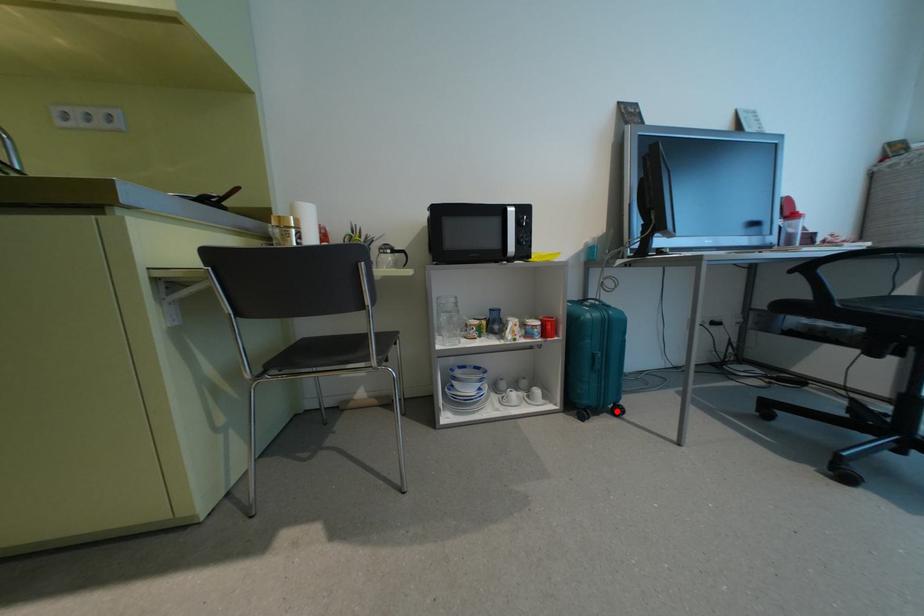
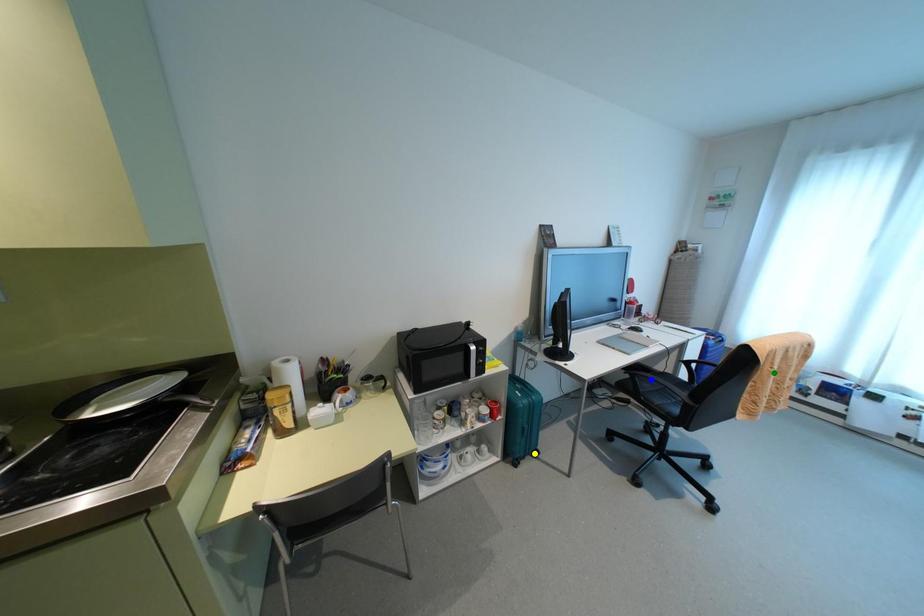
Question: I am providing you with two images of the same scene from different viewpoints. A red point is marked on the first image. You are given multiple points on the second image. Can you choose the point in image 2 that corresponds to the point in image 1?

Choices:
 (A) blue point
 (B) yellow point
 (C) green point

Answer: (B)